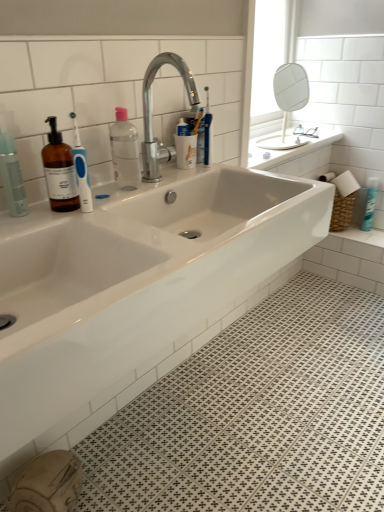
This screenshot has height=512, width=384. What do you see at coordinates (289, 149) in the screenshot? I see `white glossy sink at upper right` at bounding box center [289, 149].

Locate an element on the screen. The width and height of the screenshot is (384, 512). white glossy mirror at upper right is located at coordinates (289, 96).

Identify the location of matte black spray can at left, the first toiletry from the left. Image resolution: width=384 pixels, height=512 pixels. (12, 177).

Locate an element on the screen. The width and height of the screenshot is (384, 512). white glossy spray can at upper right, the second toiletry when ordered from front to back is located at coordinates (370, 203).

At what (x,y) coordinates should I click in order to perform the action: click on transparent plastic bottle at center. Please return your answer as a coordinate pair (x, y). This screenshot has height=512, width=384. Looking at the image, I should click on (125, 151).

Considering the relative positions of white glossy mirror at upper right and chrome metallic faucet at upper center in the image provided, is white glossy mirror at upper right behind chrome metallic faucet at upper center?

That is True.

The height and width of the screenshot is (512, 384). Find the location of `tap that is in front of the white glossy mirror at upper right`. tap that is in front of the white glossy mirror at upper right is located at coordinates (152, 114).

Considering the sizes of objects white glossy mirror at upper right and chrome metallic faucet at upper center in the image provided, who is thinner, white glossy mirror at upper right or chrome metallic faucet at upper center?

With smaller width is chrome metallic faucet at upper center.

Based on the photo, can you confirm if white glossy mirror at upper right is positioned to the right of chrome metallic faucet at upper center?

Yes.

Considering the relative sizes of white glossy sink at center and transparent plastic bottle at center in the image provided, is white glossy sink at center smaller than transparent plastic bottle at center?

Actually, white glossy sink at center might be larger than transparent plastic bottle at center.

Between point (148, 243) and point (118, 129), which one is positioned in front?

The point (148, 243) is more forward.

Between white glossy sink at center and transparent plastic bottle at center, which one is positioned behind?

transparent plastic bottle at center is more distant.

Are white glossy sink at center and transparent plastic bottle at center far apart?

No.

Is transparent plastic bottle at center turned away from white glossy sink at upper right?

transparent plastic bottle at center does not have its back to white glossy sink at upper right.

Who is more distant, transparent plastic bottle at center or white glossy sink at upper right?

Positioned behind is white glossy sink at upper right.

In the scene shown: From a real-world perspective, who is located higher, transparent plastic bottle at center or white glossy sink at upper right?

transparent plastic bottle at center.

From a real-world perspective, between matte black spray can at left, the first toiletry from the left, and chrome metallic faucet at upper center, who is vertically lower?

From a 3D spatial view, matte black spray can at left, the first toiletry from the left, is below.

Is there a large distance between matte black spray can at left, which appears as the 2th toiletry when viewed from the right, and chrome metallic faucet at upper center?

No, there isn't a large distance between matte black spray can at left, which appears as the 2th toiletry when viewed from the right, and chrome metallic faucet at upper center.

From the image's perspective, would you say matte black spray can at left, which is counted as the 1th toiletry, starting from the front, is shown under chrome metallic faucet at upper center?

Yes, from the image's perspective, matte black spray can at left, which is counted as the 1th toiletry, starting from the front, is below chrome metallic faucet at upper center.

Does matte black spray can at left, which is counted as the 1th toiletry, starting from the front, have a larger size compared to chrome metallic faucet at upper center?

No.

Is point (310, 150) closer to viewer compared to point (368, 195)?

Yes, point (310, 150) is in front of point (368, 195).

Can you tell me how much white glossy sink at upper right and white glossy spray can at upper right, the second toiletry when ordered from front to back, differ in facing direction?

There is a 87.6-degree angle between the facing directions of white glossy sink at upper right and white glossy spray can at upper right, the second toiletry when ordered from front to back.

Are white glossy sink at upper right and white glossy spray can at upper right, marked as the first toiletry in a back-to-front arrangement, making contact?

They are not placed beside each other.

Is white glossy spray can at upper right, the second toiletry when ordered from front to back, facing away from chrome metallic faucet at upper center?

No, white glossy spray can at upper right, the second toiletry when ordered from front to back,'s orientation is not away from chrome metallic faucet at upper center.

Is white glossy spray can at upper right, marked as the first toiletry in a back-to-front arrangement, taller or shorter than chrome metallic faucet at upper center?

white glossy spray can at upper right, marked as the first toiletry in a back-to-front arrangement, is shorter than chrome metallic faucet at upper center.

Considering the sizes of white glossy spray can at upper right, the second toiletry in the left-to-right sequence, and chrome metallic faucet at upper center in the image, is white glossy spray can at upper right, the second toiletry in the left-to-right sequence, bigger or smaller than chrome metallic faucet at upper center?

Clearly, white glossy spray can at upper right, the second toiletry in the left-to-right sequence, is smaller in size than chrome metallic faucet at upper center.

From the image's perspective, does white glossy spray can at upper right, the first toiletry viewed from the right, appear lower than chrome metallic faucet at upper center?

Yes, from the image's perspective, white glossy spray can at upper right, the first toiletry viewed from the right, is below chrome metallic faucet at upper center.

How much distance is there between white glossy mirror at upper right and matte black spray can at left, which is counted as the 1th toiletry, starting from the front?

white glossy mirror at upper right is 1.73 meters away from matte black spray can at left, which is counted as the 1th toiletry, starting from the front.

Considering the relative sizes of white glossy mirror at upper right and matte black spray can at left, which appears as the 2th toiletry when viewed from the back, in the image provided, is white glossy mirror at upper right wider than matte black spray can at left, which appears as the 2th toiletry when viewed from the back,?

Yes, white glossy mirror at upper right is wider than matte black spray can at left, which appears as the 2th toiletry when viewed from the back.

Which is in front, point (294, 92) or point (21, 203)?

The point (21, 203) is more forward.

Locate an element on the screen. This screenshot has width=384, height=512. mirror behind the chrome metallic faucet at upper center is located at coordinates (289, 96).

I want to click on sink on the right of transparent plastic bottle at center, so click(x=135, y=281).

In the scene shown: When comparing their distances from chrome metallic faucet at upper center, does white glossy sink at center or white glossy spray can at upper right, the second toiletry in the left-to-right sequence, seem further?

The object further to chrome metallic faucet at upper center is white glossy spray can at upper right, the second toiletry in the left-to-right sequence.

Which object lies further to the anchor point white glossy sink at upper right, white glossy spray can at upper right, the second toiletry when ordered from front to back, or white glossy mirror at upper right?

The object further to white glossy sink at upper right is white glossy spray can at upper right, the second toiletry when ordered from front to back.

Estimate the real-world distances between objects in this image. Which object is further from matte black spray can at left, which appears as the 2th toiletry when viewed from the back, white glossy sink at center or transparent plastic bottle at center?

white glossy sink at center.

Looking at the image, which one is located closer to matte black spray can at left, which appears as the 2th toiletry when viewed from the right, white glossy spray can at upper right, the second toiletry in the left-to-right sequence, or chrome metallic faucet at upper center?

The object closer to matte black spray can at left, which appears as the 2th toiletry when viewed from the right, is chrome metallic faucet at upper center.

Which object lies nearer to the anchor point white glossy spray can at upper right, the second toiletry when ordered from front to back, transparent plastic bottle at center or matte black spray can at left, which appears as the 2th toiletry when viewed from the back?

The object closer to white glossy spray can at upper right, the second toiletry when ordered from front to back, is transparent plastic bottle at center.

When comparing their distances from white glossy mirror at upper right, does white glossy sink at center or transparent plastic bottle at center seem further?

white glossy sink at center lies further to white glossy mirror at upper right than the other object.

Estimate the real-world distances between objects in this image. Which object is closer to matte black spray can at left, which is counted as the 1th toiletry, starting from the front, white glossy spray can at upper right, marked as the first toiletry in a back-to-front arrangement, or white glossy mirror at upper right?

Among the two, white glossy spray can at upper right, marked as the first toiletry in a back-to-front arrangement, is located nearer to matte black spray can at left, which is counted as the 1th toiletry, starting from the front.

Based on their spatial positions, is white glossy sink at upper right or matte black spray can at left, the first toiletry from the left, closer to chrome metallic faucet at upper center?

matte black spray can at left, the first toiletry from the left, is positioned closer to the anchor chrome metallic faucet at upper center.

Where is `counter top between chrome metallic faucet at upper center and white glossy mirror at upper right in the front-back direction`? Image resolution: width=384 pixels, height=512 pixels. counter top between chrome metallic faucet at upper center and white glossy mirror at upper right in the front-back direction is located at coordinates (289, 149).

The width and height of the screenshot is (384, 512). In order to click on mirror between chrome metallic faucet at upper center and white glossy spray can at upper right, the second toiletry in the left-to-right sequence, from front to back in this screenshot , I will do tap(289, 96).

Locate an element on the screen. The width and height of the screenshot is (384, 512). bottle positioned between white glossy sink at center and white glossy mirror at upper right from near to far is located at coordinates (125, 151).

Find the location of a particular element. Image resolution: width=384 pixels, height=512 pixels. tap between matte black spray can at left, which is counted as the 1th toiletry, starting from the front, and white glossy mirror at upper right, along the z-axis is located at coordinates (152, 114).